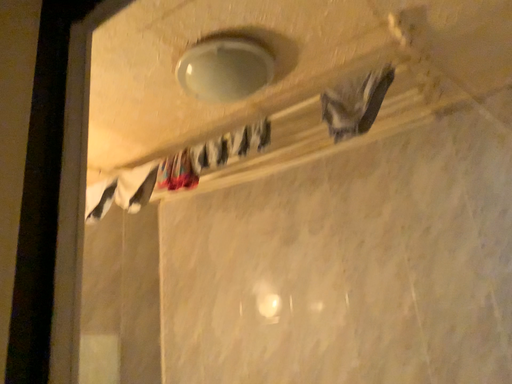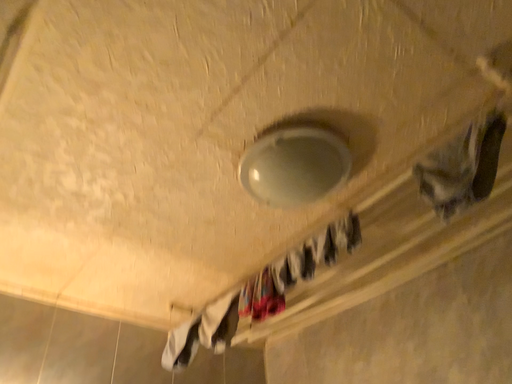
Question: How did the camera likely rotate when shooting the video?

Choices:
 (A) rotated right
 (B) rotated left

Answer: (B)